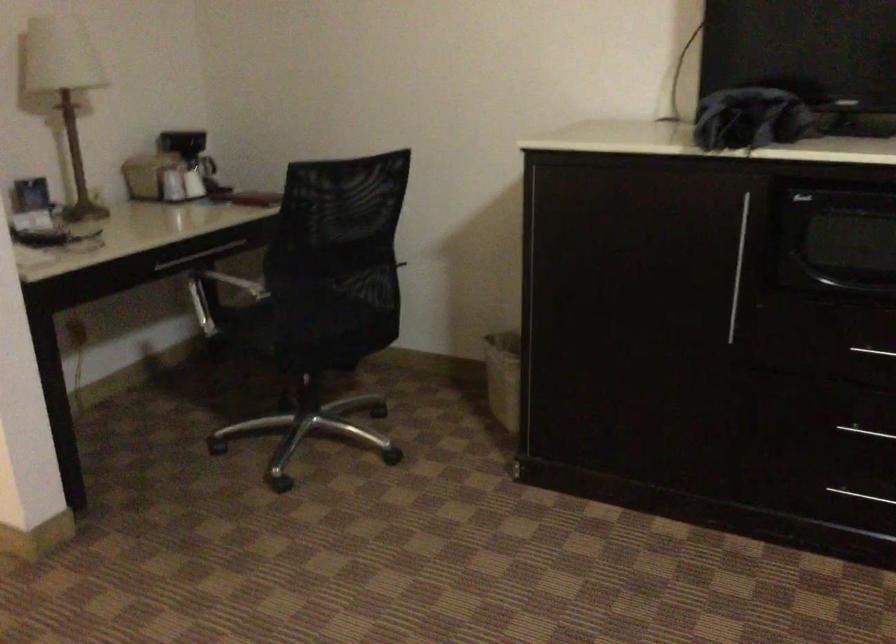
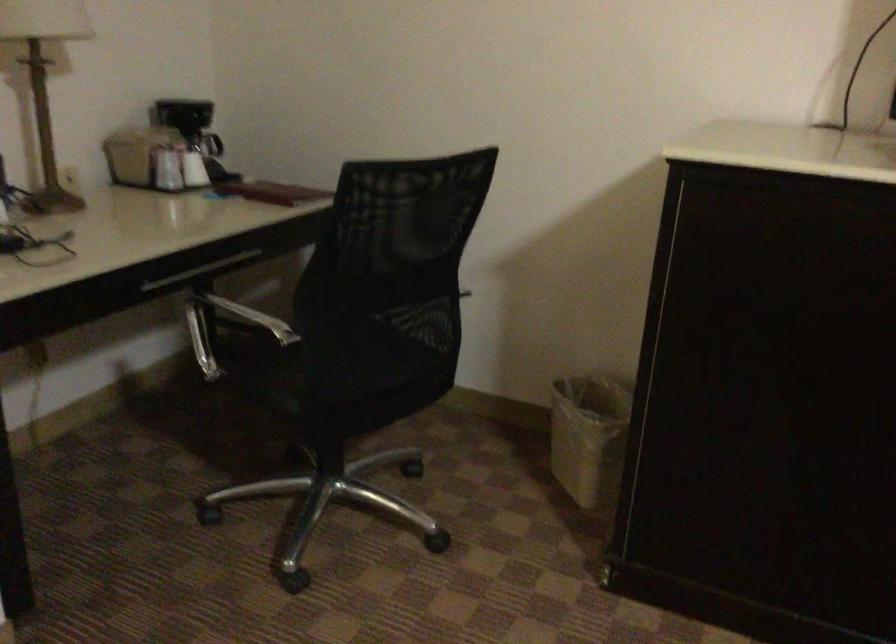
Question: The images are taken continuously from a first-person perspective. In which direction is your viewpoint rotating?

Choices:
 (A) Left
 (B) Right
 (C) Up
 (D) Down

Answer: (D)